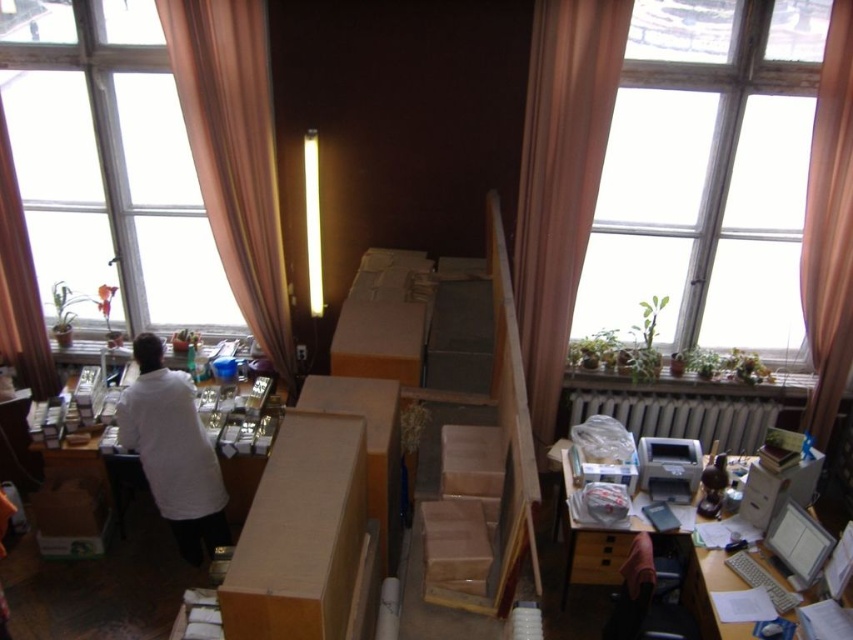
Question: Among these objects, which one is farthest from the camera?

Choices:
 (A) brown fabric curtain at right
 (B) pink fabric curtain at left
 (C) white matte lab coat at center
 (D) white matte table at center

Answer: (B)

Question: Observing the image, what is the correct spatial positioning of transparent glass window at upper center in reference to white matte table at center?

Choices:
 (A) right
 (B) left

Answer: (A)

Question: Considering the real-world distances, which object is farthest from the brown fabric curtain at right?

Choices:
 (A) brown fabric curtain at left
 (B) white glossy computer desk at lower right
 (C) transparent glass window at upper center

Answer: (A)

Question: Is transparent glass window at upper center bigger than white matte lab coat at center?

Choices:
 (A) no
 (B) yes

Answer: (B)

Question: Can you confirm if transparent glass window at upper center is thinner than white matte lab coat at center?

Choices:
 (A) yes
 (B) no

Answer: (B)

Question: Based on their relative distances, which object is nearer to the pink fabric curtain at left?

Choices:
 (A) pink fabric curtain at upper left
 (B) matte cardboard box at center
 (C) white glossy computer desk at lower right

Answer: (A)